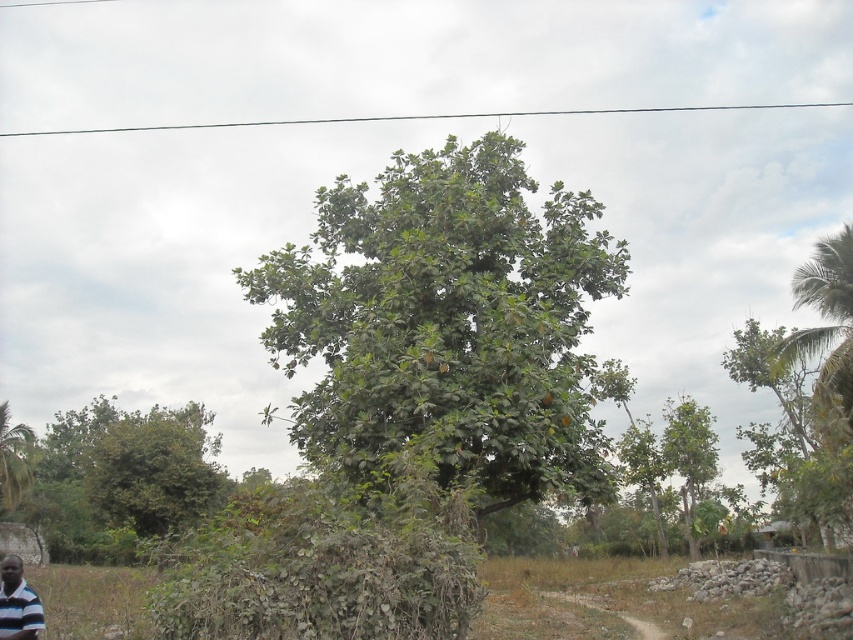
You are standing in a rural area and see the green leafy tree at center and the striped polo shirt at lower left. Which object is taller?

The green leafy tree at center is taller than the striped polo shirt at lower left.

You are standing at the point marked as point (x=447, y=323) in the rural outdoor scene. What is the nearest object to you?

The point (x=447, y=323) is on the green leafy tree at center, so the nearest object to you is the green leafy tree at center.

You are standing in the middle of a forest clearing and see the green leafy tree at center and the green leafy tree at right. Which tree appears closer to you?

The green leafy tree at center is located above the green leafy tree at right, so the green leafy tree at right is closer to you.